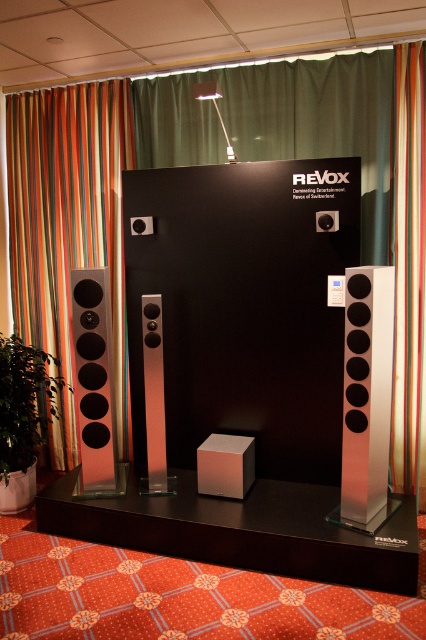
Does striped fabric curtain at upper center appear on the right side of satin silver speaker at center?

Indeed, striped fabric curtain at upper center is positioned on the right side of satin silver speaker at center.

Between striped fabric curtain at upper center and satin silver speaker at center, which one is positioned lower?

satin silver speaker at center is below.

Describe the element at coordinates (408, 266) in the screenshot. I see `striped fabric curtain at upper center` at that location.

Find the location of a particular element. The image size is (426, 640). striped fabric curtain at upper center is located at coordinates (408, 266).

Is the position of satin silver speaker at left more distant than that of metallic silver cube at center?

Yes, satin silver speaker at left is further from the viewer.

What do you see at coordinates (94, 380) in the screenshot?
I see `satin silver speaker at left` at bounding box center [94, 380].

What do you see at coordinates (94, 380) in the screenshot? I see `satin silver speaker at left` at bounding box center [94, 380].

At what (x,y) coordinates should I click in order to perform the action: click on satin silver speaker at left. Please return your answer as a coordinate pair (x, y). The width and height of the screenshot is (426, 640). Looking at the image, I should click on (94, 380).

Is striped fabric at left to the left of satin silver speaker at center from the viewer's perspective?

Indeed, striped fabric at left is positioned on the left side of satin silver speaker at center.

Is striped fabric at left shorter than satin silver speaker at center?

No.

Image resolution: width=426 pixels, height=640 pixels. In order to click on striped fabric at left in this screenshot , I will do `click(68, 214)`.